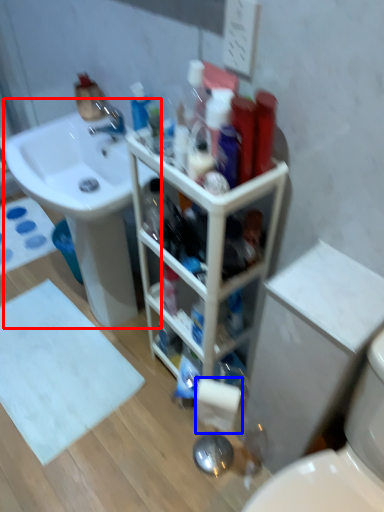
Question: Which object appears closest to the camera in this image, sink (highlighted by a red box) or toilet paper (highlighted by a blue box)?

Choices:
 (A) sink
 (B) toilet paper

Answer: (B)